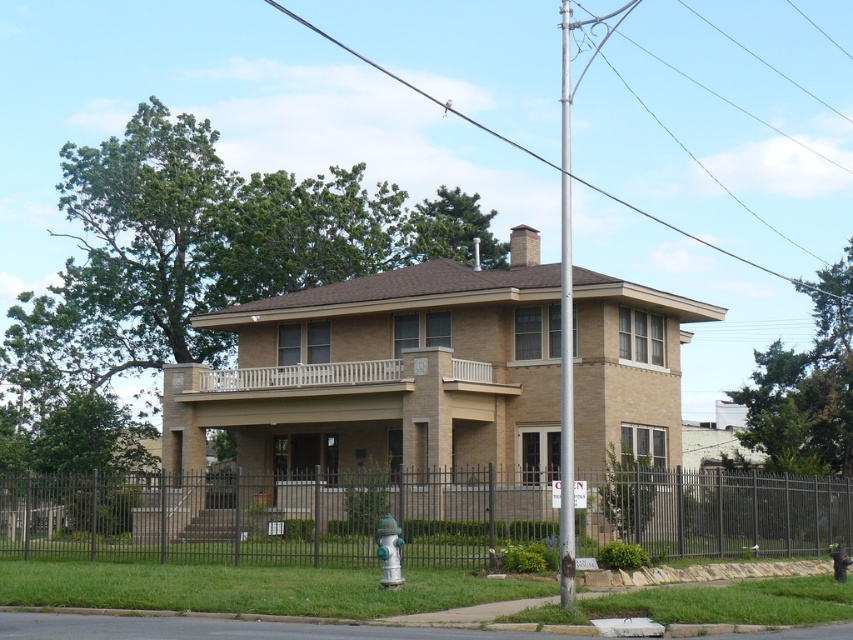
Based on the photo, you are a painter standing in front of the house and want to paint the white painted wood pole at center and the metallic wire at upper center. Which object should you paint first if you want to paint the one closer to you first?

The white painted wood pole at center is in front of the metallic wire at upper center, so you should paint the white painted wood pole at center first since it is closer to you.

You are standing in front of the house and notice the white painted wood pole at center and the metallic wire at upper center. From your perspective, which object is positioned to the left?

The white painted wood pole at center is to the left of the metallic wire at upper center.

You are standing in front of the house and want to walk from the black metal fence at lower center to the white painted wood pole at center. Which direction should you move to get closer to the pole?

To get closer to the white painted wood pole at center, you should move forward because the black metal fence at lower center is further away from you than the pole.